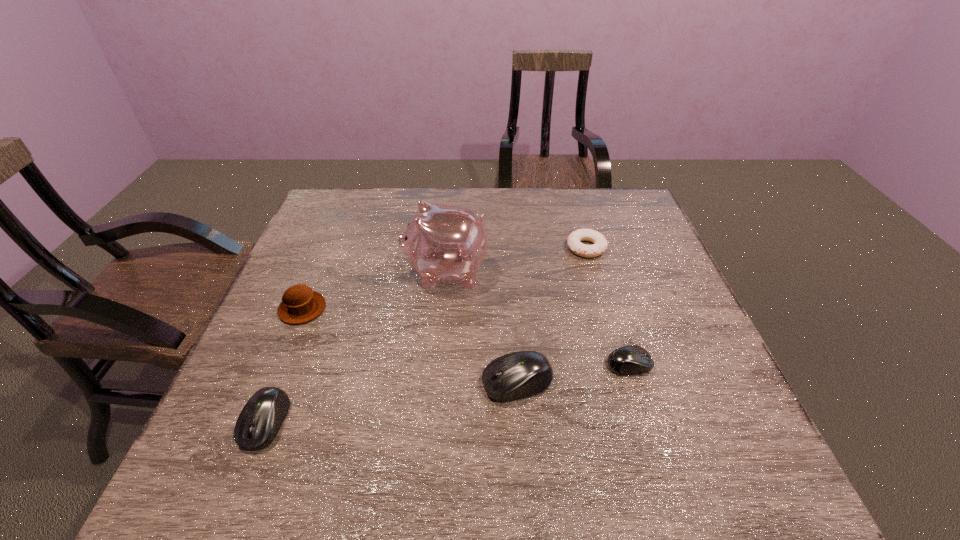
Where is `blank region between the tallest object and the doughnut`? blank region between the tallest object and the doughnut is located at coordinates (516, 260).

Identify the location of vacant region between the muffin and the rightmost mouse. (466, 336).

Locate an element on the screen. vacant space in between the leftmost mouse and the muffin is located at coordinates (284, 366).

In order to click on vacant space in between the muffin and the rightmost mouse in this screenshot , I will do `click(466, 336)`.

In order to click on vacant region between the doughnut and the rightmost mouse in this screenshot , I will do `click(608, 306)`.

Identify which object is the second nearest to the second mouse from left to right. Please provide its 2D coordinates. Your answer should be formatted as a tuple, i.e. [(x, y)], where the tuple contains the x and y coordinates of a point satisfying the conditions above.

[(442, 243)]

Identify which object is the fifth closest to the piggy bank. Please provide its 2D coordinates. Your answer should be formatted as a tuple, i.e. [(x, y)], where the tuple contains the x and y coordinates of a point satisfying the conditions above.

[(260, 420)]

Locate an element on the screen. Image resolution: width=960 pixels, height=540 pixels. mouse that stands as the second closest to the doughnut is located at coordinates (521, 374).

Locate an element on the screen. The image size is (960, 540). mouse that is the second nearest to the piggy bank is located at coordinates (628, 360).

Identify the location of vacant area that satisfies the following two spatial constraints: 1. on the back side of the rightmost mouse; 2. on the front facing side of the piggy bank. Image resolution: width=960 pixels, height=540 pixels. (601, 272).